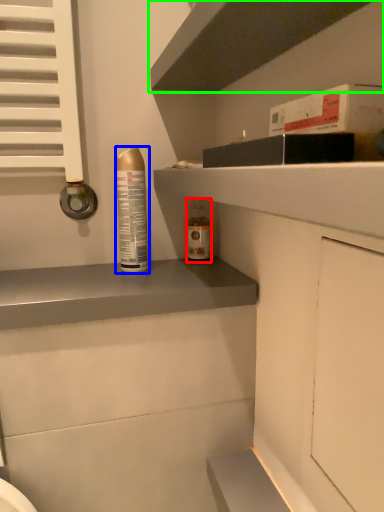
Question: Which object is the closest to the bottle (highlighted by a red box)? Choose among these: bottle (highlighted by a blue box) or shelf (highlighted by a green box).

Choices:
 (A) bottle
 (B) shelf

Answer: (A)